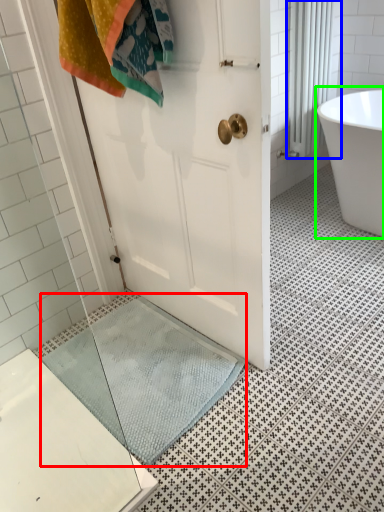
Question: Estimate the real-world distances between objects in this image. Which object is closer to bath mat (highlighted by a red box), shower curtain (highlighted by a blue box) or bathtub (highlighted by a green box)?

Choices:
 (A) shower curtain
 (B) bathtub

Answer: (B)